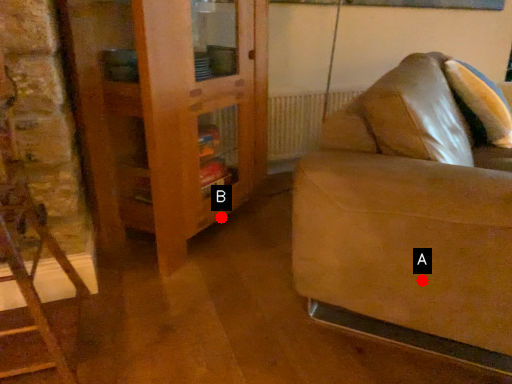
Question: Two points are circled on the image, labeled by A and B beside each circle. Which of the following is the closest to the observer?

Choices:
 (A) A is closer
 (B) B is closer

Answer: (A)